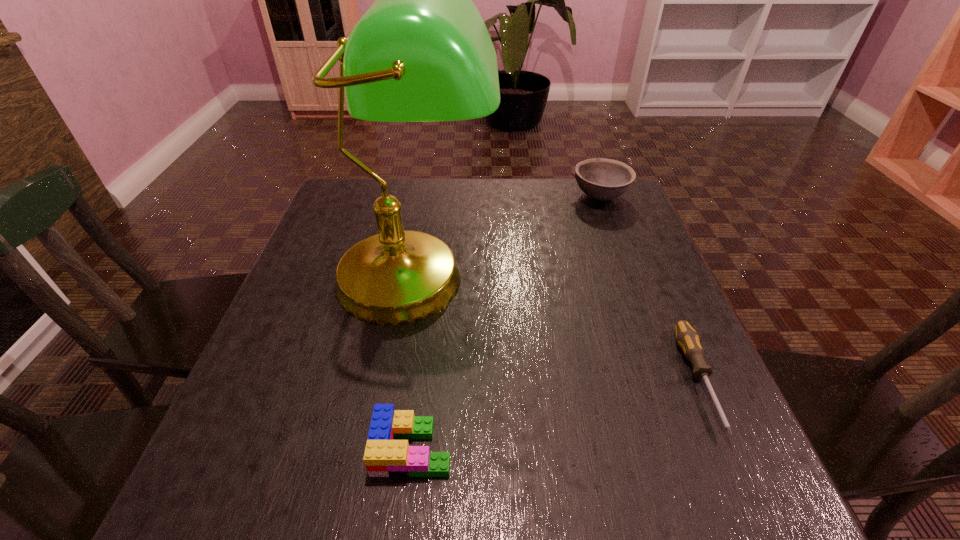
I want to click on lamp, so click(x=421, y=53).

Locate an element on the screen. This screenshot has width=960, height=540. the second tallest object is located at coordinates (602, 179).

At what (x,y) coordinates should I click in order to perform the action: click on bowl. Please return your answer as a coordinate pair (x, y). The height and width of the screenshot is (540, 960). Looking at the image, I should click on (602, 179).

I want to click on Lego, so click(x=384, y=456).

You are a GUI agent. You are given a task and a screenshot of the screen. Output one action in this format:
    pyautogui.click(x=<x>, y=<y>)
    Task: Click on the shortest object
    Image resolution: width=960 pixels, height=540 pixels.
    Given the screenshot: What is the action you would take?
    pyautogui.click(x=687, y=338)

Identify the location of vacant space located 0.110m on the desk next to the tallest object. The height and width of the screenshot is (540, 960). (395, 401).

Locate an element on the screen. The width and height of the screenshot is (960, 540). free location located on the front of the third shortest object is located at coordinates (648, 325).

This screenshot has width=960, height=540. In order to click on vacant area situated on the right of the Lego in this screenshot , I will do `click(686, 448)`.

Identify the location of vacant space located 0.060m at the tip of the screwdriver. This screenshot has width=960, height=540. (743, 481).

Find the location of `object present at the far edge`. object present at the far edge is located at coordinates (602, 179).